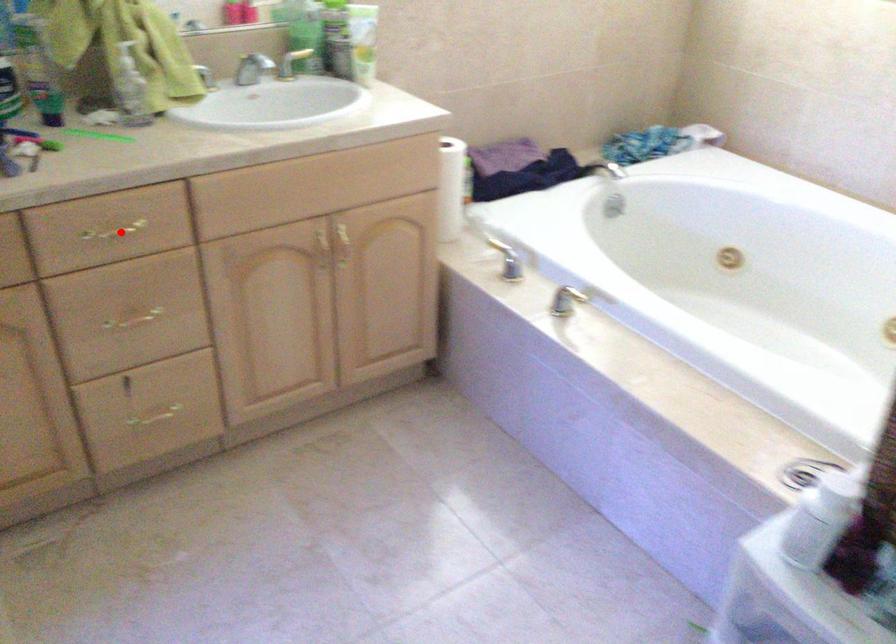
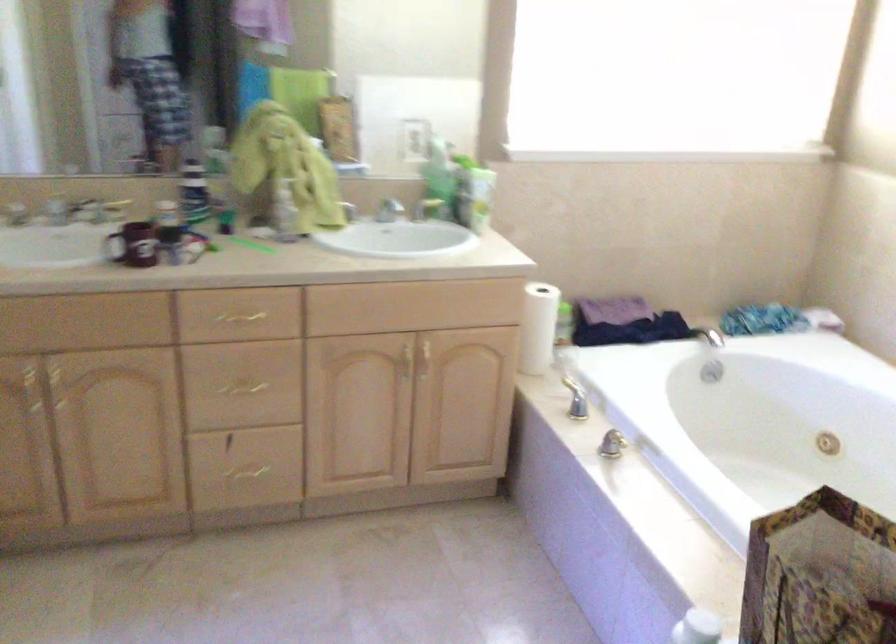
Question: I am providing you with two images of the same scene from different viewpoints. A red point is shown in image1. For the corresponding object point in image2, is it positioned nearer or farther from the camera?

Choices:
 (A) Nearer
 (B) Farther

Answer: (B)